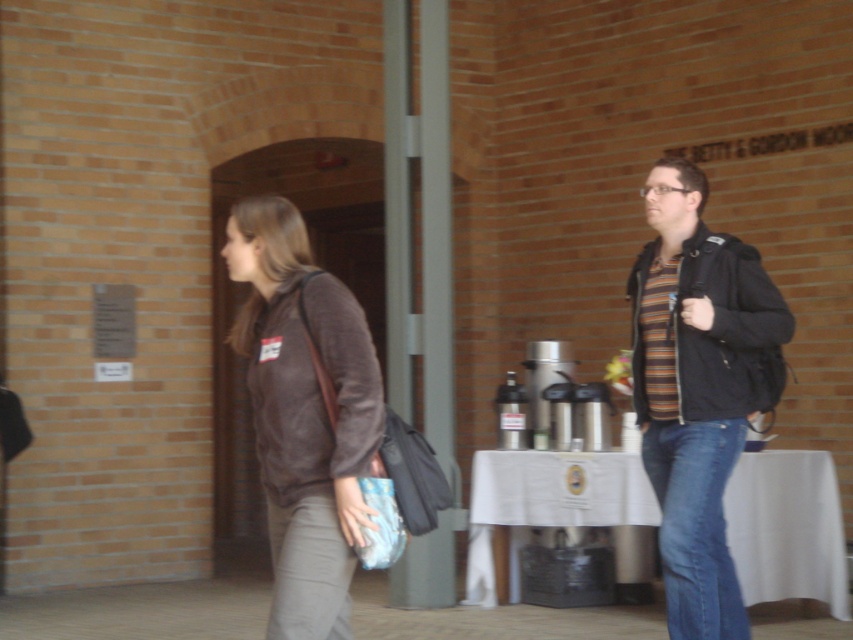
Does striped knit sweater at center appear over brown suede jacket at left?

Actually, striped knit sweater at center is below brown suede jacket at left.

Which is more to the left, striped knit sweater at center or brown suede jacket at left?

brown suede jacket at left is more to the left.

Locate an element on the screen. striped knit sweater at center is located at coordinates (698, 387).

Can you confirm if brown suede jacket at left is shorter than white cloth-covered table at lower center?

In fact, brown suede jacket at left may be taller than white cloth-covered table at lower center.

Is point (265, 428) farther from camera compared to point (757, 541)?

No, it is in front of (757, 541).

Is point (378, 371) more distant than point (773, 504)?

That is False.

The image size is (853, 640). What are the coordinates of `brown suede jacket at left` in the screenshot? It's located at (305, 413).

Can you confirm if striped knit sweater at center is taller than white cloth-covered table at lower center?

Indeed, striped knit sweater at center has a greater height compared to white cloth-covered table at lower center.

Who is taller, striped knit sweater at center or white cloth-covered table at lower center?

striped knit sweater at center

Does point (730, 365) come behind point (558, 460)?

That is False.

Where is `striped knit sweater at center`? This screenshot has width=853, height=640. striped knit sweater at center is located at coordinates click(x=698, y=387).